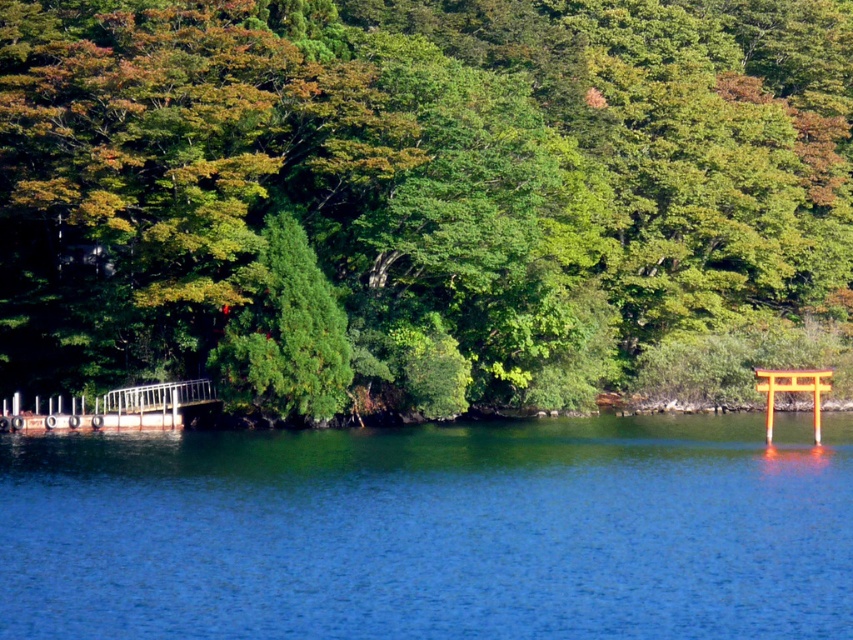
You are standing at the lakeside and want to walk towards the orange glossy torii gate at right. Which direction should you turn to first see the green leafy tree at center?

To first see the green leafy tree at center when walking towards the orange glossy torii gate at right, you should turn to your left since the green leafy tree at center is positioned to the left of the orange glossy torii gate at right.

You are standing at the dock on the left side of the lake and want to locate two points marked in the scene. The first point is at coordinates point (219, 301) and the second is at point (770, 381). From your current position, which point is closer to you?

Point (770, 381) is closer to you because it is in front of point (219, 301) according to the description.

You are standing at the edge of the lake and want to locate the green leafy tree at center. Based on the coordinates provided, in which direction should you look to find it?

The green leafy tree at center is located at coordinates point (415, 192), which is in the center of the image. So you should look straight ahead to find it.